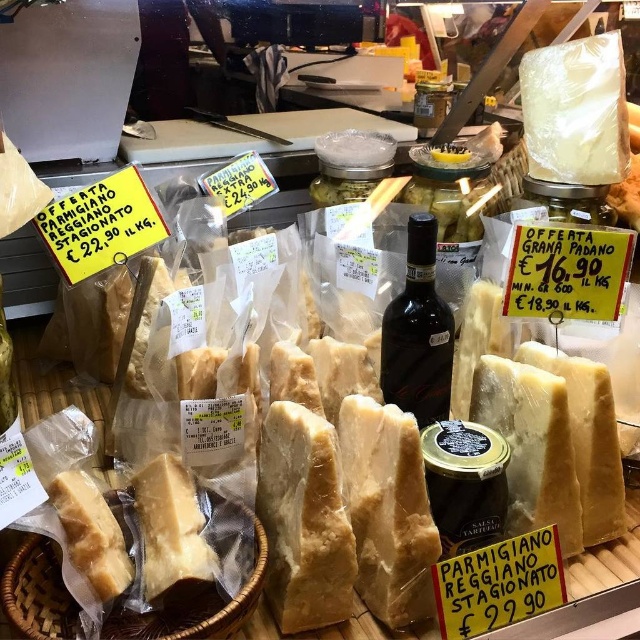
You are a customer at the deli and want to grab both the translucent plastic bag at lower left and the dark glass bottle at center. Which one should you pick up first to reach the one on the right?

You should pick up the translucent plastic bag at lower left first because it is to the left of the dark glass bottle at center, so the bottle is on the right side.

You are a customer at the deli and want to grab both the translucent plastic bag at lower left and the dark glass bottle at center. Which item should you reach for first to avoid knocking over the other?

You should reach for the translucent plastic bag at lower left first because it is closer to you than the dark glass bottle at center, so you can grab it without disturbing the other item.

You are a customer at the deli and want to choose between the translucent plastic bag at lower left and the dark glass bottle at center. Which one has a larger size?

The translucent plastic bag at lower left is bigger than the dark glass bottle at center.